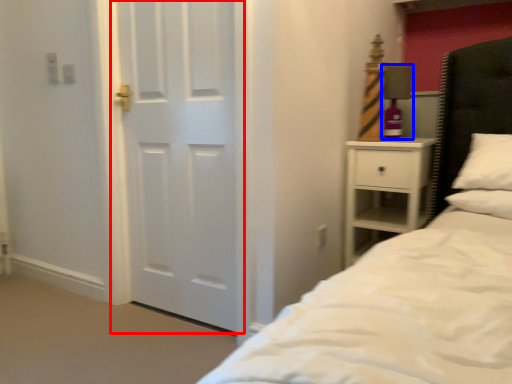
Question: Which of the following is the closest to the observer, door (highlighted by a red box) or lamp (highlighted by a blue box)?

Choices:
 (A) door
 (B) lamp

Answer: (A)